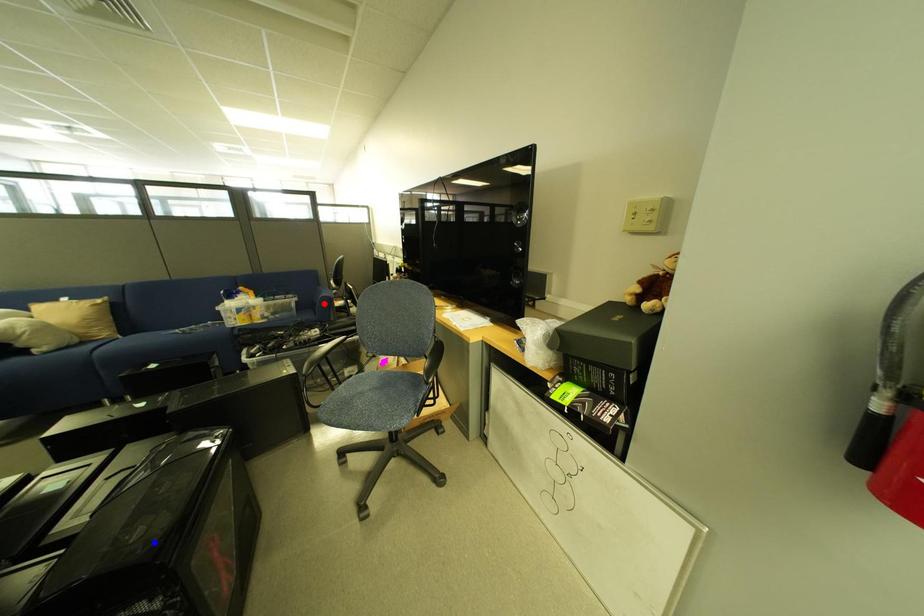
Question: Which of the two points in the image is closer to the camera?

Choices:
 (A) Blue point is closer.
 (B) Red point is closer.

Answer: (A)